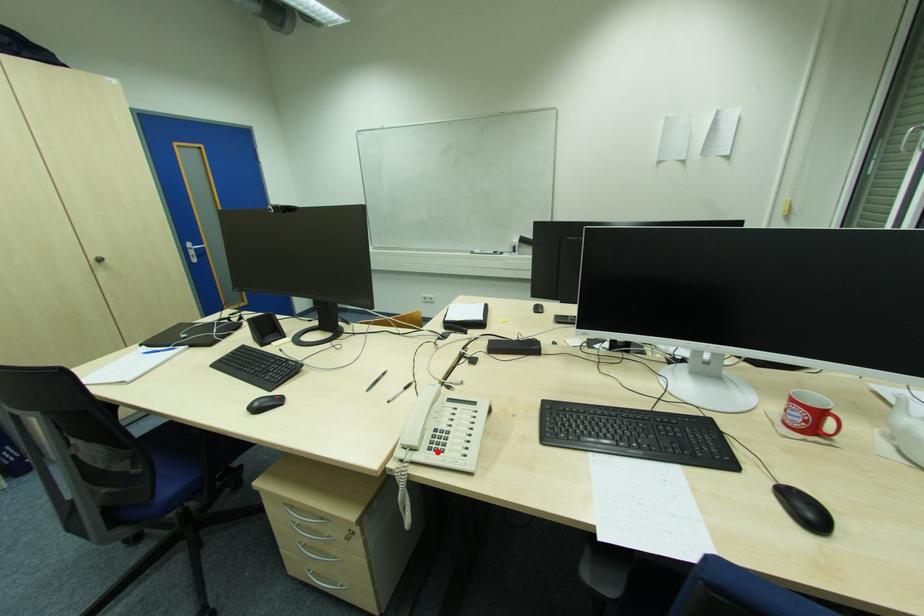
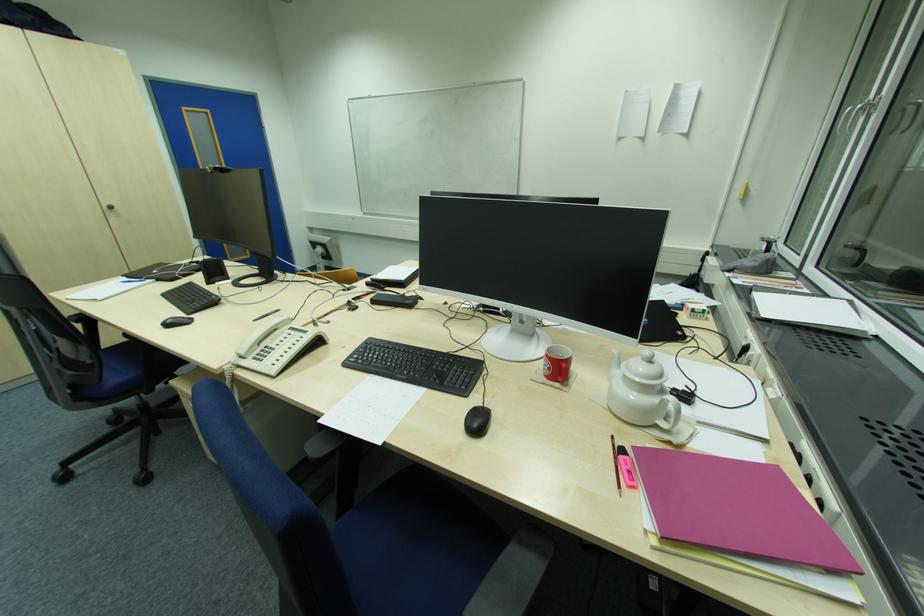
Question: I am providing you with two images of the same scene from different viewpoints. Image1 has a red point marked. In image2, the corresponding 3D location appears at what relative position? Reply with the corresponding letter.

Choices:
 (A) Closer
 (B) Farther

Answer: (A)